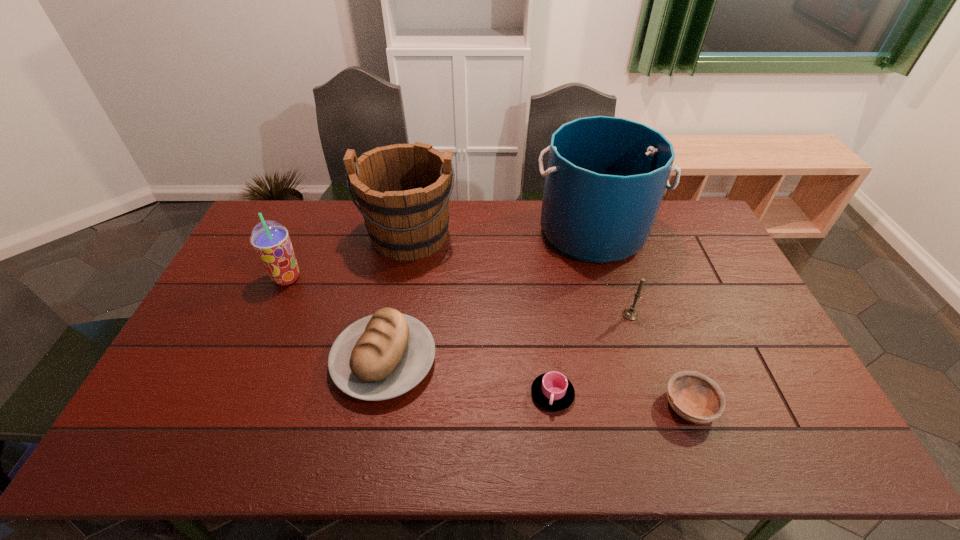
Locate an element on the screen. The width and height of the screenshot is (960, 540). vacant region at the near edge of the desktop is located at coordinates (437, 440).

I want to click on vacant region at the right edge of the desktop, so click(x=781, y=360).

In the image, there is a desktop. In order to click on free region at the far left corner in this screenshot , I will do `click(288, 231)`.

In the image, there is a desktop. At what (x,y) coordinates should I click in order to perform the action: click on vacant space at the near right corner. Please return your answer as a coordinate pair (x, y). Looking at the image, I should click on (771, 447).

Locate an element on the screen. Image resolution: width=960 pixels, height=540 pixels. vacant area between the bucket and the leftmost object is located at coordinates (440, 255).

I want to click on free space between the bread and the candle, so click(x=508, y=338).

Locate an element on the screen. The height and width of the screenshot is (540, 960). unoccupied area between the third tallest object and the bread is located at coordinates (336, 319).

Locate an element on the screen. The image size is (960, 540). blank region between the smoothie and the wine bucket is located at coordinates (348, 256).

You are a GUI agent. You are given a task and a screenshot of the screen. Output one action in this format:
    pyautogui.click(x=<x>, y=<y>)
    Task: Click on the vacant space in between the wine bucket and the bucket
    
    Given the screenshot: What is the action you would take?
    pyautogui.click(x=502, y=233)

I want to click on blank region between the wine bucket and the bucket, so click(502, 233).